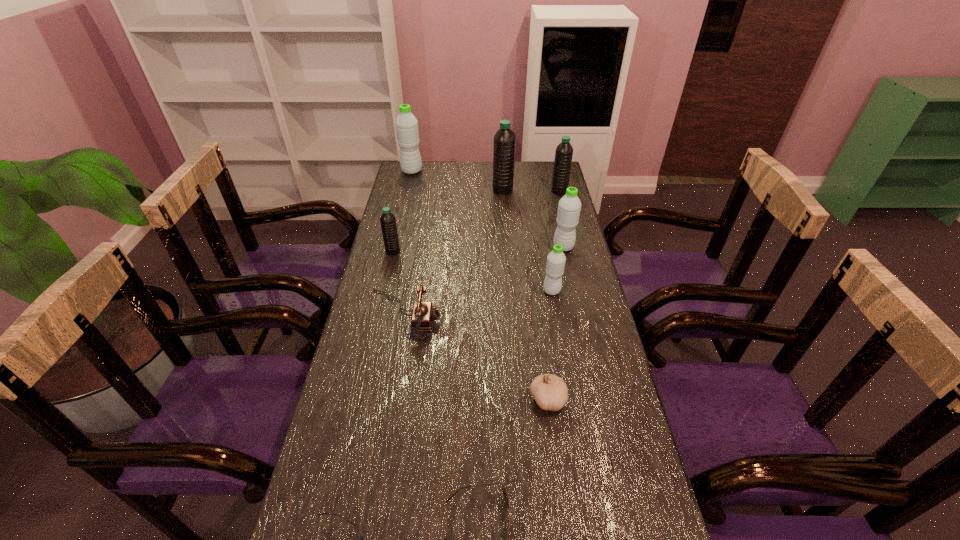
You are a GUI agent. You are given a task and a screenshot of the screen. Output one action in this format:
    pyautogui.click(x=<x>, y=<y>)
    Task: Click on the vacant space located on the dial of the telephone
    Image resolution: width=960 pixels, height=540 pixels.
    Given the screenshot: What is the action you would take?
    pyautogui.click(x=565, y=315)

This screenshot has width=960, height=540. Identify the location of vacant position located on the front of the garlic. (561, 500).

I want to click on telephone that is at the left edge, so click(x=423, y=314).

Where is `garlic that is at the right edge`? This screenshot has width=960, height=540. garlic that is at the right edge is located at coordinates (550, 392).

Find the location of a particular element. This screenshot has height=540, width=960. object that is at the far left corner is located at coordinates (406, 123).

This screenshot has width=960, height=540. Identify the location of object present at the far right corner. (x=564, y=151).

Locate an element on the screen. The width and height of the screenshot is (960, 540). vacant space at the far edge of the desktop is located at coordinates coord(461,173).

This screenshot has width=960, height=540. Identify the location of vacant space at the left edge. (347, 516).

The height and width of the screenshot is (540, 960). I want to click on vacant space at the right edge, so click(x=546, y=208).

This screenshot has height=540, width=960. Identify the location of free spot between the second black water bottle from right to left and the leftmost black water bottle. click(x=447, y=220).